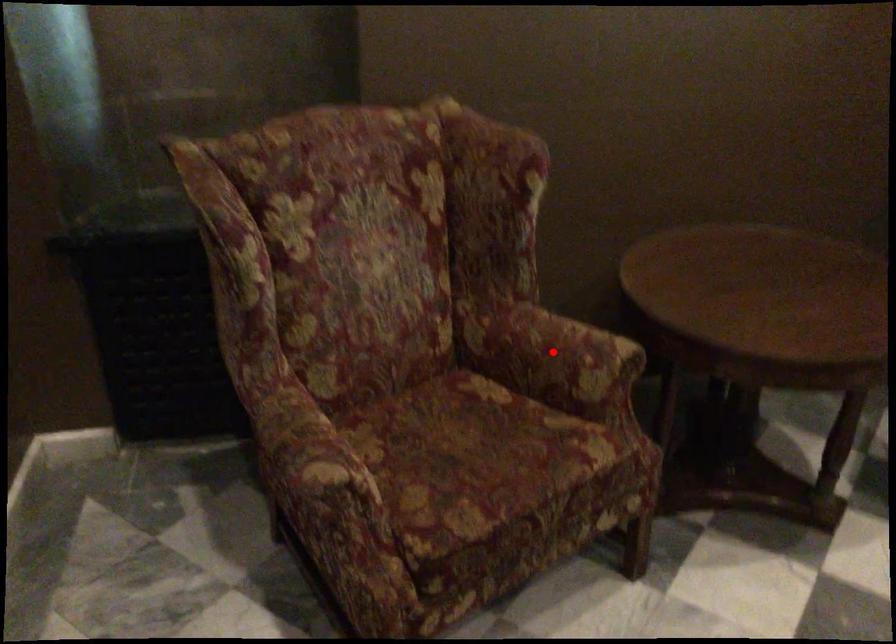
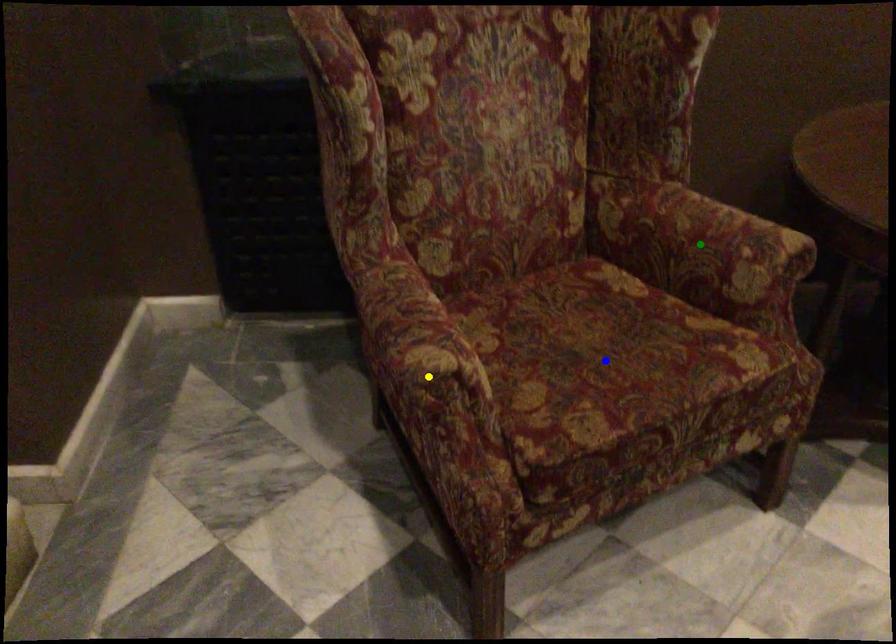
Question: I am providing you with two images of the same scene from different viewpoints. A red point is marked on the first image. You are given multiple points on the second image. Which spot in image 2 lines up with the point in image 1?

Choices:
 (A) blue point
 (B) yellow point
 (C) green point

Answer: (C)